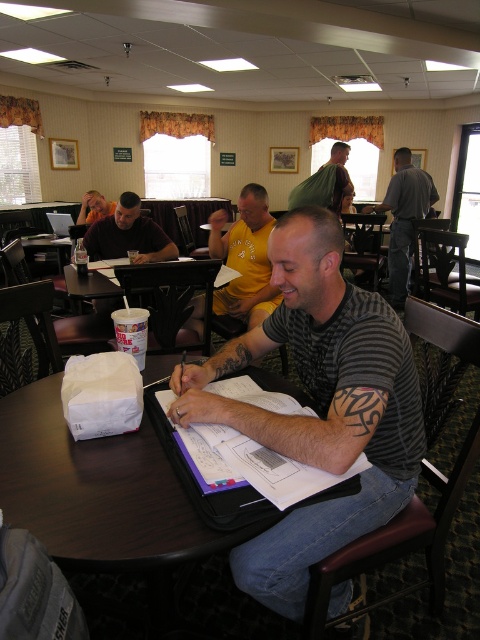
You are a photographer setting up a shot in the room. You need to position a small tripod so that it can capture both the matte black shirt at center and the matte black laptop at upper left without moving the camera. Which object should you place the tripod closer to, the one that is shorter or taller?

The matte black shirt at center has a lesser height compared to the matte black laptop at upper left. To capture both in the frame, the tripod should be placed closer to the shorter object, which is the matte black shirt at center, to ensure the taller laptop is not cropped out.

You are a tailor who needs to measure the distance between the gray cotton shirt at upper right and the matte black shirt at center for alterations. Can you reach both shirts with a 2.5 meter long measuring tape?

The gray cotton shirt at upper right and matte black shirt at center are 2.45 meters apart, so yes, the 2.5 meter measuring tape is long enough to reach both shirts.

You are a photographer taking a picture of the matte black shirt at center and the matte black laptop at upper left. Which object should you focus on first if you want to capture both in the frame without moving the camera?

The matte black shirt at center is positioned on the right side of the matte black laptop at upper left, so you should focus on the matte black laptop at upper left first as it is closer to the left side and will ensure both are in frame without moving the camera.